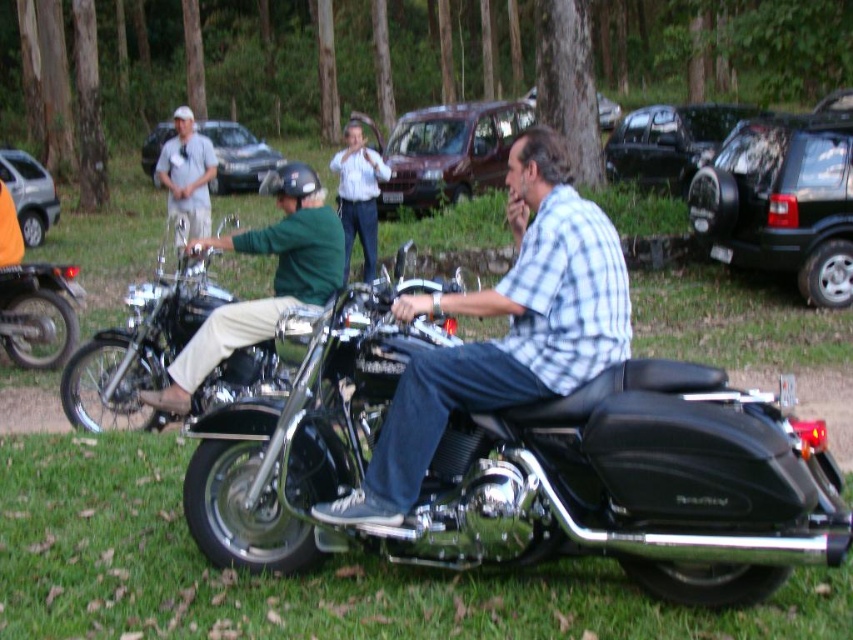
You are standing at point (280, 260) and want to reach a nearby tree that is 10 meters away. Can you walk straight ahead without encountering any obstacles?

The two people on the black motorcycle with chrome detailing are 5.78 meters apart, so yes, you can walk straight ahead without encountering any obstacles since the distance to the tree is 10 meters, which is farther than the space between them.

Consider the image. You are a photographer trying to capture a clear shot of the green fabric shirt at center and the white matte cap at upper left. Which object should you zoom in on to ensure it appears larger in your photo?

The green fabric shirt at center is smaller than the white matte cap at upper left, so you should zoom in on the green fabric shirt at center to make it appear larger in the photo.